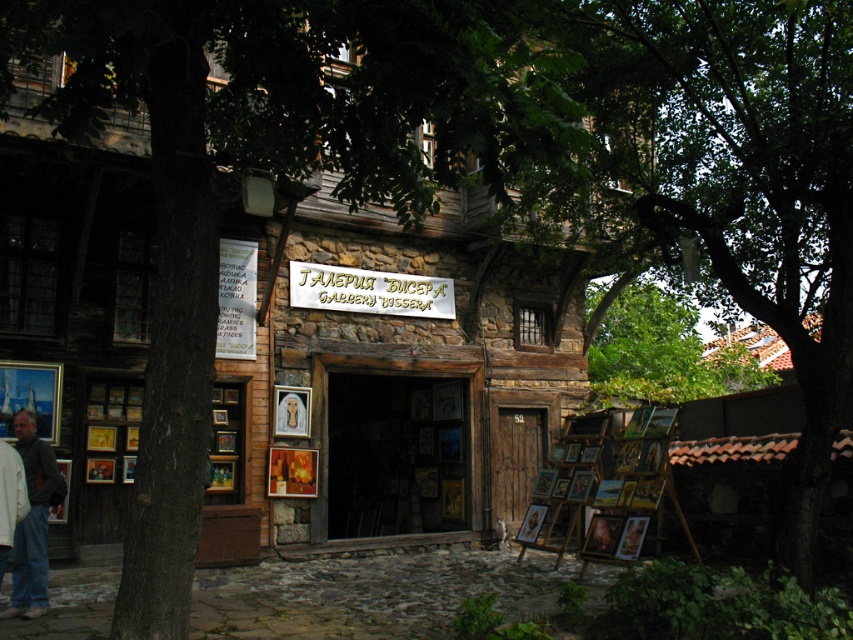
You are standing in front of the gallery and notice a green leafy tree at upper left and a gold metallic sign at center. From your perspective, which object is positioned to the right of the other?

The green leafy tree at upper left is positioned to the right of the gold metallic sign at center.

You are standing at the entrance of the gallery and want to take a photo of the green leafy tree at upper left. You have a camera that can focus up to 5 meters. Can you capture the tree clearly with your camera?

The green leafy tree at upper left and camera are 5.11 meters apart from each other. Since the camera can focus up to 5 meters, the distance is slightly beyond its range. Therefore, you cannot capture the tree clearly with your current camera settings.